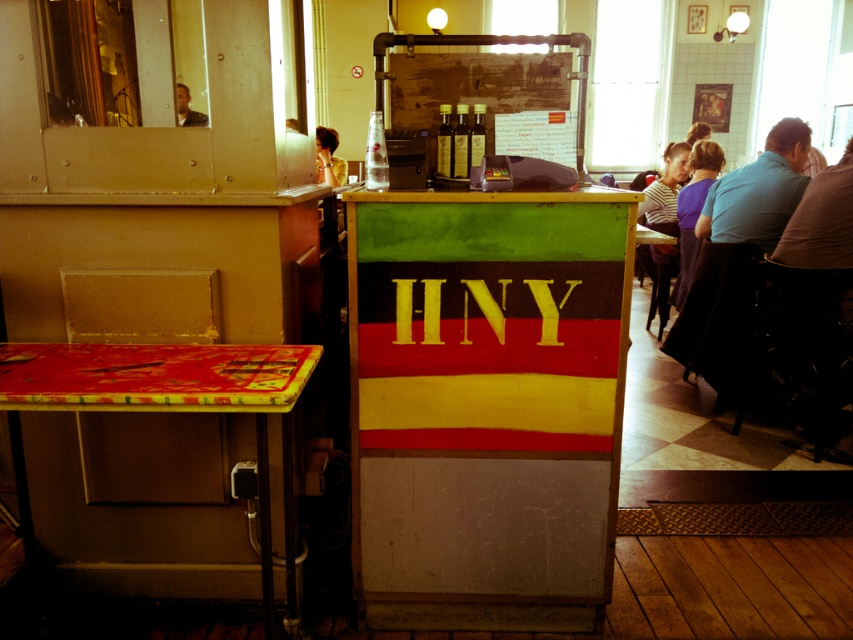
You are standing at the entrance of the retro diner and see two points marked in the scene. The first point is at coordinate point [107,376] and the second is at point [186,106]. Which point is closer to you as you face the scene?

Point [107,376] is in front of point [186,106], so it is closer to you as you face the scene.

You are a customer in the diner and want to place your order. You see a shiny plastic table at left and a yellow shirt at upper left. How far apart are these two items?

The shiny plastic table at left is 3.68 meters from the yellow shirt at upper left.

You are a customer in the diner and want to order a drink. You see a person with a blue fabric shirt at right and another with matte black hair at upper left. Which staff member is closer to you if you are standing at the counter near the red top surface?

The blue fabric shirt at right is closer to you because it is only 8.49 feet away from the matte black hair at upper left, but since you are at the counter near the red top surface, which is to the left of the signboard, the blue fabric shirt at right would be farther away than the matte black hair at upper left. Wait, this might be conflicting. Let me think again. The objects description says the two are 8.49 feet apart. The question is about which is closer to the customer at the counter near the red top.